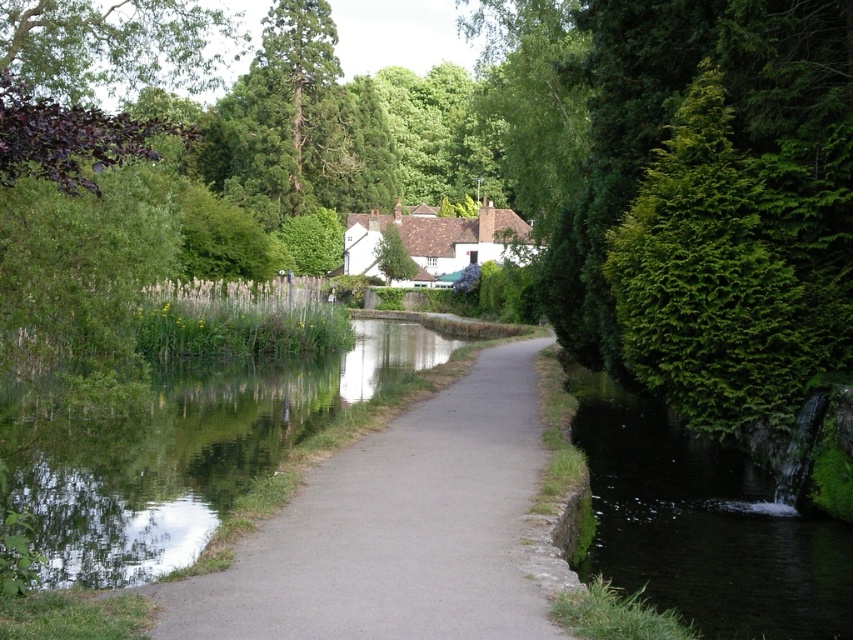
Question: Does smooth asphalt path at center have a larger size compared to green leafy tree at center?

Choices:
 (A) no
 (B) yes

Answer: (A)

Question: Does green textured hedge at right lie in front of green leafy tree at center?

Choices:
 (A) no
 (B) yes

Answer: (B)

Question: Can you confirm if green textured hedge at right is thinner than green leafy tree at center?

Choices:
 (A) no
 (B) yes

Answer: (B)

Question: Which of the following is the farthest from the observer?

Choices:
 (A) white matte cottage at center
 (B) smooth asphalt path at center
 (C) green textured hedge at right
 (D) green leafy tree at center

Answer: (D)

Question: Which object is farther from the camera taking this photo?

Choices:
 (A) green textured hedge at right
 (B) green leafy tree at center

Answer: (B)

Question: Estimate the real-world distances between objects in this image. Which object is closer to the smooth asphalt path at center?

Choices:
 (A) green textured hedge at right
 (B) white matte cottage at center
 (C) green leafy tree at center

Answer: (A)